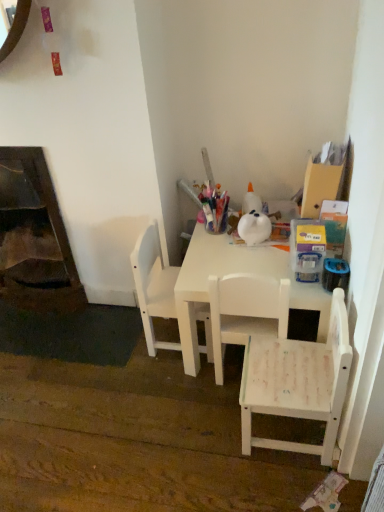
Where is `free location in front of white matte chair at center, the 2th chair when ordered from left to right`? The width and height of the screenshot is (384, 512). free location in front of white matte chair at center, the 2th chair when ordered from left to right is located at coordinates (216, 414).